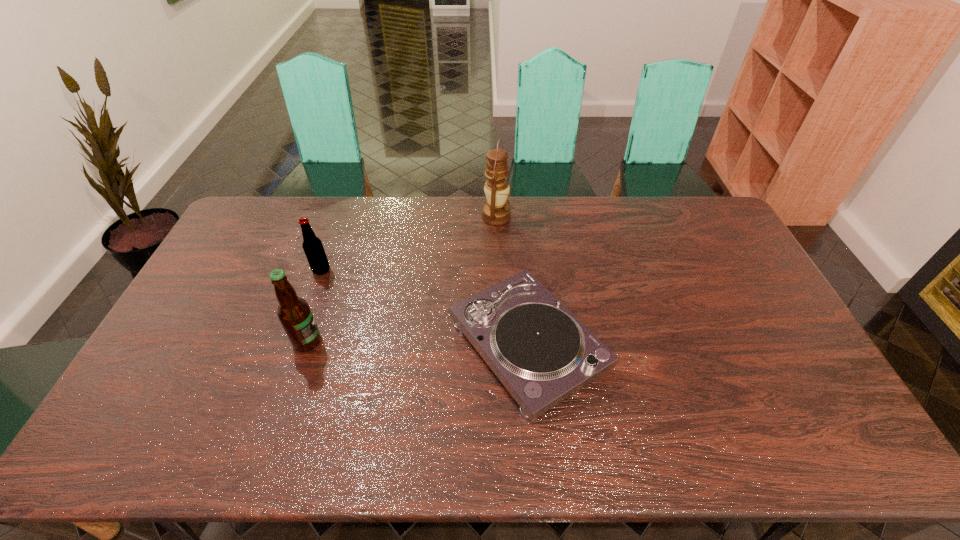
Where is `oil lamp`? This screenshot has height=540, width=960. oil lamp is located at coordinates (496, 212).

Locate an element on the screen. Image resolution: width=960 pixels, height=540 pixels. the taller beer bottle is located at coordinates (294, 313).

Find the location of `the shorter beer bottle`. the shorter beer bottle is located at coordinates (312, 245).

Find the location of a particular element. the farther beer bottle is located at coordinates (312, 245).

The height and width of the screenshot is (540, 960). I want to click on the shortest object, so click(542, 353).

Image resolution: width=960 pixels, height=540 pixels. I want to click on vacant space located 0.280m on the left of the oil lamp, so click(408, 217).

The height and width of the screenshot is (540, 960). I want to click on vacant space situated on the label of the nearer beer bottle, so click(453, 342).

Where is `blank space located on the left of the third nearest object`? blank space located on the left of the third nearest object is located at coordinates (207, 270).

The width and height of the screenshot is (960, 540). Identify the location of free point located on the back of the shortest object. (518, 246).

Locate an element on the screen. This screenshot has height=540, width=960. object that is at the far edge is located at coordinates (496, 212).